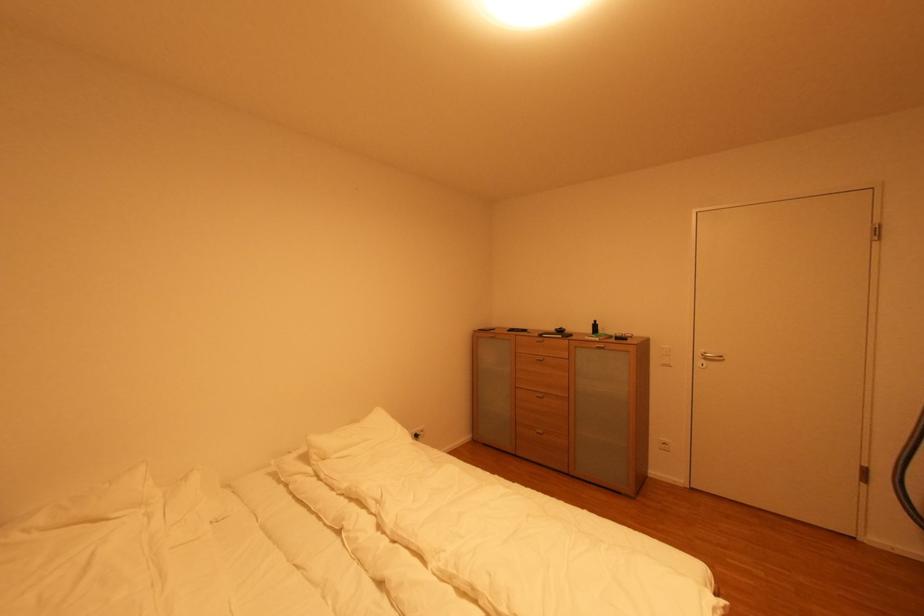
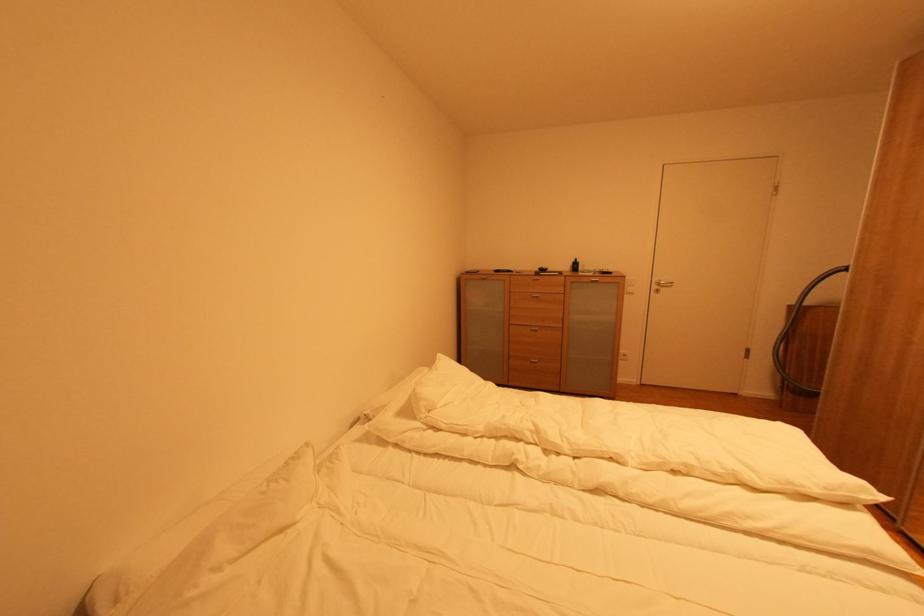
The point at (548, 361) is marked in the first image. Where is the corresponding point in the second image?

(542, 298)